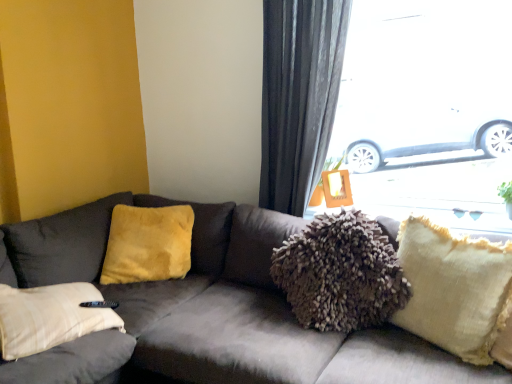
Locate an element on the screen. velvet gray couch at center is located at coordinates (222, 304).

Describe the element at coordinates (222, 304) in the screenshot. I see `velvet gray couch at center` at that location.

How much space does beige textured pillow at right, the second pillow when ordered from left to right, occupy horizontally?

beige textured pillow at right, the second pillow when ordered from left to right, is 8.11 inches in width.

The width and height of the screenshot is (512, 384). What do you see at coordinates (447, 217) in the screenshot? I see `fuzzy fabric pillow at upper right` at bounding box center [447, 217].

Identify the location of velvet yellow pillow at left, which is the 2th pillow in right-to-left order. Image resolution: width=512 pixels, height=384 pixels. (148, 244).

In order to face dark gray fabric curtain at upper right, should I rotate leftwards or rightwards?

Rotate your view right by about 7.274°.

This screenshot has height=384, width=512. Find the location of `dark gray fabric curtain at upper right`. dark gray fabric curtain at upper right is located at coordinates (298, 96).

The width and height of the screenshot is (512, 384). What are the coordinates of `velvet gray couch at center` in the screenshot? It's located at (222, 304).

Considering the sizes of objects velvet yellow pillow at left, which is the 2th pillow in right-to-left order, and dark gray fabric curtain at upper right in the image provided, who is smaller, velvet yellow pillow at left, which is the 2th pillow in right-to-left order, or dark gray fabric curtain at upper right?

A: With smaller size is velvet yellow pillow at left, which is the 2th pillow in right-to-left order.

Looking at this image, who is taller, velvet yellow pillow at left, the 2th pillow viewed from the front, or dark gray fabric curtain at upper right?

With more height is dark gray fabric curtain at upper right.

How different are the orientations of velvet yellow pillow at left, the 2th pillow viewed from the front, and dark gray fabric curtain at upper right in degrees?

The angular difference between velvet yellow pillow at left, the 2th pillow viewed from the front, and dark gray fabric curtain at upper right is 33.1 degrees.

Is velvet yellow pillow at left, which is the 2th pillow in right-to-left order, thinner than dark gray fabric curtain at upper right?

No, velvet yellow pillow at left, which is the 2th pillow in right-to-left order, is not thinner than dark gray fabric curtain at upper right.

From the image's perspective, which object appears higher, velvet yellow pillow at left, the 2th pillow viewed from the front, or transparent glass window at upper right?

transparent glass window at upper right, from the image's perspective.

Is velvet yellow pillow at left, which is the 2th pillow in right-to-left order, turned away from transparent glass window at upper right?

No, velvet yellow pillow at left, which is the 2th pillow in right-to-left order,'s orientation is not away from transparent glass window at upper right.

Is velvet yellow pillow at left, the 2th pillow viewed from the front, wider than transparent glass window at upper right?

In fact, velvet yellow pillow at left, the 2th pillow viewed from the front, might be narrower than transparent glass window at upper right.

Considering the positions of objects velvet yellow pillow at left, placed as the 1th pillow when sorted from left to right, and transparent glass window at upper right in the image provided, who is more to the right, velvet yellow pillow at left, placed as the 1th pillow when sorted from left to right, or transparent glass window at upper right?

Positioned to the right is transparent glass window at upper right.

Is fuzzy fabric pillow at upper right wider than dark gray fabric curtain at upper right?

Yes.

Is point (469, 215) closer to camera compared to point (270, 77)?

Yes, point (469, 215) is in front of point (270, 77).

Can you confirm if fuzzy fabric pillow at upper right is bigger than dark gray fabric curtain at upper right?

Actually, fuzzy fabric pillow at upper right might be smaller than dark gray fabric curtain at upper right.

Considering the sizes of fuzzy fabric pillow at upper right and dark gray fabric curtain at upper right in the image, is fuzzy fabric pillow at upper right taller or shorter than dark gray fabric curtain at upper right?

In the image, fuzzy fabric pillow at upper right appears to be shorter than dark gray fabric curtain at upper right.

Is point (176, 246) positioned behind point (396, 313)?

Yes.

From the image's perspective, which one is positioned lower, velvet yellow pillow at left, the 2th pillow viewed from the front, or beige textured pillow at right, which appears as the second pillow when viewed from the back?

beige textured pillow at right, which appears as the second pillow when viewed from the back, from the image's perspective.

Is beige textured pillow at right, the second pillow when ordered from left to right, at the back of velvet yellow pillow at left, arranged as the 1th pillow when viewed from the back?

No.

From a real-world perspective, is velvet yellow pillow at left, placed as the 1th pillow when sorted from left to right, below beige textured pillow at right, which appears as the second pillow when viewed from the back?

No.

How different are the orientations of beige textured pillow at right, positioned as the 1th pillow in front-to-back order, and velvet gray couch at center in degrees?

The facing directions of beige textured pillow at right, positioned as the 1th pillow in front-to-back order, and velvet gray couch at center are 15.2 degrees apart.

Between beige textured pillow at right, which is the first pillow from right to left, and velvet gray couch at center, which one is positioned behind?

beige textured pillow at right, which is the first pillow from right to left, is more distant.

Is beige textured pillow at right, the second pillow when ordered from left to right, located outside velvet gray couch at center?

No, beige textured pillow at right, the second pillow when ordered from left to right, is not outside of velvet gray couch at center.

Which of these two, beige textured pillow at right, which is the first pillow from right to left, or velvet gray couch at center, is bigger?

Bigger between the two is velvet gray couch at center.

Is beige textured pillow at right, positioned as the 1th pillow in front-to-back order, outside of velvet yellow pillow at left, the 2th pillow viewed from the front?

Yes.

Is point (430, 219) closer or farther from the camera than point (150, 267)?

Point (430, 219) is closer to the camera than point (150, 267).

Considering the relative sizes of beige textured pillow at right, which appears as the second pillow when viewed from the back, and velvet yellow pillow at left, which is the 2th pillow in right-to-left order, in the image provided, is beige textured pillow at right, which appears as the second pillow when viewed from the back, wider than velvet yellow pillow at left, which is the 2th pillow in right-to-left order,?

No.

From a real-world perspective, which object stands above the other?

fuzzy fabric pillow at upper right, from a real-world perspective.

Considering the relative sizes of beige textured pillow at right, which is the first pillow from right to left, and fuzzy fabric pillow at upper right in the image provided, is beige textured pillow at right, which is the first pillow from right to left, shorter than fuzzy fabric pillow at upper right?

Incorrect, the height of beige textured pillow at right, which is the first pillow from right to left, does not fall short of that of fuzzy fabric pillow at upper right.

Which of these two, beige textured pillow at right, which appears as the second pillow when viewed from the back, or fuzzy fabric pillow at upper right, is wider?

fuzzy fabric pillow at upper right.

From the image's perspective, starting from the dark gray fabric curtain at upper right, which pillow is the 1st one below? Please provide its 2D coordinates.

[(148, 244)]

Where is `the 2nd pillow counting from the left of the transparent glass window at upper right`? the 2nd pillow counting from the left of the transparent glass window at upper right is located at coordinates (148, 244).

Based on their spatial positions, is velvet gray couch at center or fuzzy fabric pillow at upper right further from transparent glass window at upper right?

The object further to transparent glass window at upper right is velvet gray couch at center.

Estimate the real-world distances between objects in this image. Which object is closer to beige textured pillow at right, positioned as the 1th pillow in front-to-back order, dark gray fabric curtain at upper right or velvet yellow pillow at left, the 2th pillow viewed from the front?

dark gray fabric curtain at upper right.

Estimate the real-world distances between objects in this image. Which object is closer to fuzzy fabric pillow at upper right, beige textured pillow at right, which appears as the second pillow when viewed from the back, or dark gray fabric curtain at upper right?

beige textured pillow at right, which appears as the second pillow when viewed from the back, is positioned closer to the anchor fuzzy fabric pillow at upper right.

Looking at the image, which one is located further to dark gray fabric curtain at upper right, transparent glass window at upper right or fuzzy fabric pillow at upper right?

fuzzy fabric pillow at upper right is further to dark gray fabric curtain at upper right.

Which object lies nearer to the anchor point beige textured pillow at right, positioned as the 1th pillow in front-to-back order, fuzzy fabric pillow at upper right or dark gray fabric curtain at upper right?

The object closer to beige textured pillow at right, positioned as the 1th pillow in front-to-back order, is fuzzy fabric pillow at upper right.

Considering their positions, is dark gray fabric curtain at upper right positioned further to velvet yellow pillow at left, which is the 2th pillow in right-to-left order, than velvet gray couch at center?

The object further to velvet yellow pillow at left, which is the 2th pillow in right-to-left order, is dark gray fabric curtain at upper right.

Estimate the real-world distances between objects in this image. Which object is further from dark gray fabric curtain at upper right, velvet yellow pillow at left, which is the 2th pillow in right-to-left order, or fuzzy fabric pillow at upper right?

Among the two, velvet yellow pillow at left, which is the 2th pillow in right-to-left order, is located further to dark gray fabric curtain at upper right.

Based on their spatial positions, is velvet gray couch at center or dark gray fabric curtain at upper right further from fuzzy fabric pillow at upper right?

velvet gray couch at center lies further to fuzzy fabric pillow at upper right than the other object.

Identify the location of curtain between velvet gray couch at center and transparent glass window at upper right in the front-back direction. (298, 96).

Where is `curtain between transparent glass window at upper right and fuzzy fabric pillow at upper right in the vertical direction`? The height and width of the screenshot is (384, 512). curtain between transparent glass window at upper right and fuzzy fabric pillow at upper right in the vertical direction is located at coordinates (298, 96).

Locate an element on the screen. window positioned between velvet gray couch at center and velvet yellow pillow at left, placed as the 1th pillow when sorted from left to right, from near to far is located at coordinates (392, 105).

Image resolution: width=512 pixels, height=384 pixels. What are the coordinates of `window sill between velvet gray couch at center and velvet yellow pillow at left, which is the 2th pillow in right-to-left order, along the z-axis` in the screenshot? It's located at (447, 217).